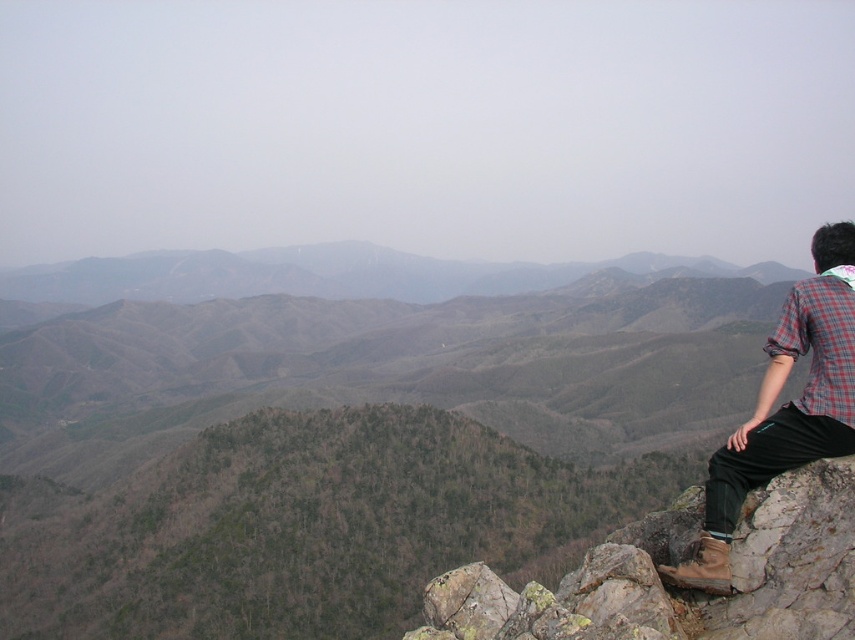
You are standing in the mountain landscape and see the brown rocky cliff at right and the plaid fabric shirt at right. Which object is positioned to the left of the other?

The brown rocky cliff at right is to the left of the plaid fabric shirt at right.

You are standing at the base of the mountain and see the point marked as point (x=677, y=589). Which direction should you walk to reach the brown rocky cliff at right?

The point (x=677, y=589) represents the brown rocky cliff at right, so you are already at the desired location.